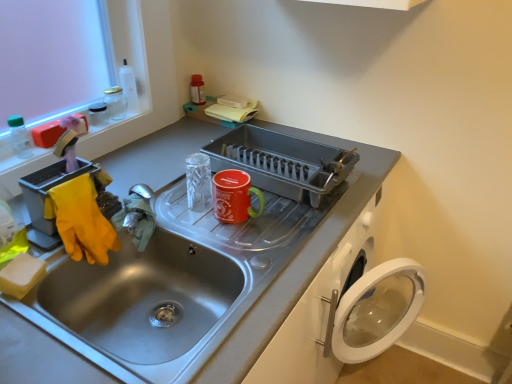
Question: From a real-world perspective, is glossy ceramic mug at upper center, the second appliance in the right-to-left sequence, on transparent plastic bottle at upper left?

Choices:
 (A) no
 (B) yes

Answer: (A)

Question: Considering the relative sizes of glossy ceramic mug at upper center, the second appliance in the right-to-left sequence, and transparent plastic bottle at upper left in the image provided, is glossy ceramic mug at upper center, the second appliance in the right-to-left sequence, smaller than transparent plastic bottle at upper left?

Choices:
 (A) no
 (B) yes

Answer: (A)

Question: From the image's perspective, is glossy ceramic mug at upper center, arranged as the 2th appliance when viewed from the left, above transparent plastic bottle at upper left?

Choices:
 (A) yes
 (B) no

Answer: (B)

Question: Can you confirm if glossy ceramic mug at upper center, arranged as the 2th appliance when viewed from the left, is positioned to the right of transparent plastic bottle at upper left?

Choices:
 (A) no
 (B) yes

Answer: (B)

Question: Is glossy ceramic mug at upper center, arranged as the 2th appliance when viewed from the left, behind transparent plastic bottle at upper left?

Choices:
 (A) no
 (B) yes

Answer: (A)

Question: Considering the relative positions of glossy ceramic mug at upper center, the second appliance in the right-to-left sequence, and stainless steel sink at center in the image provided, is glossy ceramic mug at upper center, the second appliance in the right-to-left sequence, to the left or to the right of stainless steel sink at center?

Choices:
 (A) right
 (B) left

Answer: (A)

Question: From the image's perspective, is glossy ceramic mug at upper center, arranged as the 2th appliance when viewed from the left, located above or below stainless steel sink at center?

Choices:
 (A) below
 (B) above

Answer: (B)

Question: In terms of width, does glossy ceramic mug at upper center, arranged as the 2th appliance when viewed from the left, look wider or thinner when compared to stainless steel sink at center?

Choices:
 (A) thin
 (B) wide

Answer: (A)

Question: Considering the positions of point (251, 213) and point (151, 344), is point (251, 213) closer or farther from the camera than point (151, 344)?

Choices:
 (A) farther
 (B) closer

Answer: (A)

Question: From the image's perspective, is metallic gray dish rack at center, the third appliance from the left, positioned above or below stainless steel sink at center?

Choices:
 (A) below
 (B) above

Answer: (B)

Question: From a real-world perspective, is metallic gray dish rack at center, the third appliance from the left, physically located above or below stainless steel sink at center?

Choices:
 (A) above
 (B) below

Answer: (A)

Question: Is metallic gray dish rack at center, the third appliance from the left, wider or thinner than stainless steel sink at center?

Choices:
 (A) wide
 (B) thin

Answer: (B)

Question: Would you say metallic gray dish rack at center, the third appliance from the left, is inside or outside stainless steel sink at center?

Choices:
 (A) inside
 (B) outside

Answer: (A)

Question: Is stainless steel sink at center to the left or to the right of clear glass jar at upper left, which is the third appliance from right to left, in the image?

Choices:
 (A) right
 (B) left

Answer: (A)

Question: Looking at the image, does stainless steel sink at center seem bigger or smaller compared to clear glass jar at upper left, which is the third appliance from right to left?

Choices:
 (A) big
 (B) small

Answer: (A)